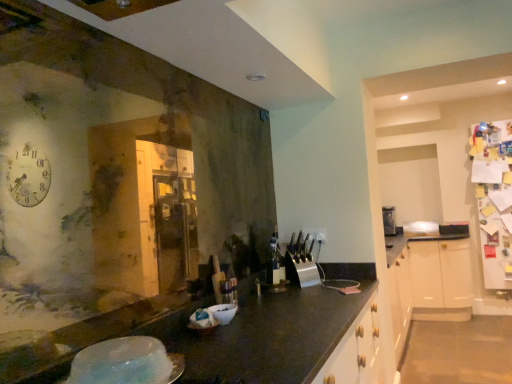
Question: Is translucent plastic bowl at lower left shorter than white glossy bowl at center?

Choices:
 (A) no
 (B) yes

Answer: (B)

Question: Does translucent plastic bowl at lower left appear on the right side of white glossy bowl at center?

Choices:
 (A) no
 (B) yes

Answer: (A)

Question: Is translucent plastic bowl at lower left not within white glossy bowl at center?

Choices:
 (A) yes
 (B) no

Answer: (A)

Question: From a real-world perspective, is translucent plastic bowl at lower left located higher than white glossy bowl at center?

Choices:
 (A) no
 (B) yes

Answer: (B)

Question: Is translucent plastic bowl at lower left bigger than white glossy bowl at center?

Choices:
 (A) no
 (B) yes

Answer: (B)

Question: From the image's perspective, is translucent plastic bowl at lower left above white glossy bowl at center?

Choices:
 (A) yes
 (B) no

Answer: (A)

Question: Would you say white glossy bowl at center is a long distance from translucent plastic bowl at lower left?

Choices:
 (A) no
 (B) yes

Answer: (A)

Question: Can you confirm if white glossy bowl at center is positioned to the right of translucent plastic bowl at lower left?

Choices:
 (A) yes
 (B) no

Answer: (A)

Question: From a real-world perspective, is white glossy bowl at center positioned under translucent plastic bowl at lower left based on gravity?

Choices:
 (A) yes
 (B) no

Answer: (A)

Question: Is white glossy bowl at center closer to the viewer compared to translucent plastic bowl at lower left?

Choices:
 (A) yes
 (B) no

Answer: (B)

Question: Can you confirm if white glossy bowl at center is taller than translucent plastic bowl at lower left?

Choices:
 (A) yes
 (B) no

Answer: (A)

Question: Are white glossy bowl at center and translucent plastic bowl at lower left beside each other?

Choices:
 (A) no
 (B) yes

Answer: (A)

Question: Would you say white glossy bowl at center is to the left or to the right of translucent plastic bowl at lower left in the picture?

Choices:
 (A) right
 (B) left

Answer: (A)